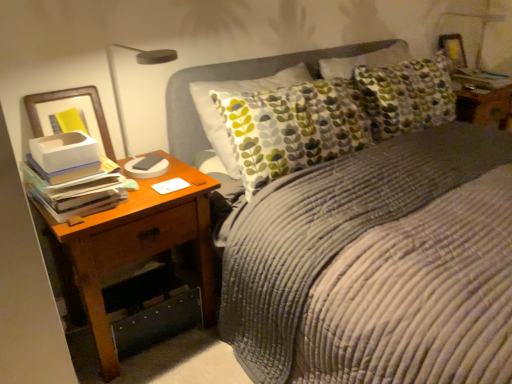
Question: Is point (67, 162) closer or farther from the camera than point (415, 246)?

Choices:
 (A) closer
 (B) farther

Answer: (A)

Question: From the image's perspective, is white paper stack at left above or below corduroy fabric bed at center?

Choices:
 (A) above
 (B) below

Answer: (B)

Question: Which of these objects is positioned farthest from the brown wood nightstand at left?

Choices:
 (A) corduroy fabric bed at center
 (B) white paper stack at left

Answer: (A)

Question: Estimate the real-world distances between objects in this image. Which object is closer to the brown wood nightstand at left?

Choices:
 (A) white paper stack at left
 (B) corduroy fabric bed at center

Answer: (A)